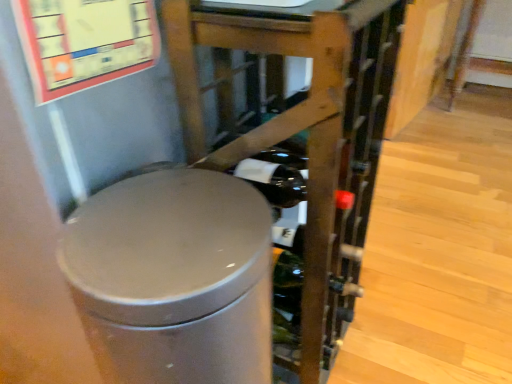
Where is `satin silver trash can at center`? satin silver trash can at center is located at coordinates click(x=174, y=278).

Describe the element at coordinates (174, 278) in the screenshot. I see `satin silver trash can at center` at that location.

Describe the element at coordinates (303, 150) in the screenshot. The height and width of the screenshot is (384, 512). I see `matte gray trash can at center` at that location.

The height and width of the screenshot is (384, 512). I want to click on matte gray trash can at center, so point(303,150).

Image resolution: width=512 pixels, height=384 pixels. I want to click on satin silver trash can at center, so click(174, 278).

Does satin silver trash can at center appear on the right side of matte gray trash can at center?

Incorrect, satin silver trash can at center is not on the right side of matte gray trash can at center.

In the image, is satin silver trash can at center positioned in front of or behind matte gray trash can at center?

Visually, satin silver trash can at center is located in front of matte gray trash can at center.

Is point (161, 345) less distant than point (315, 8)?

Yes.

From the image's perspective, is satin silver trash can at center above or below matte gray trash can at center?

satin silver trash can at center is situated lower than matte gray trash can at center in the image.

From a real-world perspective, is satin silver trash can at center physically located above or below matte gray trash can at center?

From a real-world perspective, satin silver trash can at center is physically below matte gray trash can at center.

Can you confirm if satin silver trash can at center is wider than matte gray trash can at center?

In fact, satin silver trash can at center might be narrower than matte gray trash can at center.

From their relative heights in the image, would you say satin silver trash can at center is taller or shorter than matte gray trash can at center?

satin silver trash can at center is shorter than matte gray trash can at center.

Which of these two, satin silver trash can at center or matte gray trash can at center, is bigger?

matte gray trash can at center is bigger.

Choose the correct answer: Is satin silver trash can at center inside matte gray trash can at center or outside it?

The correct answer is: outside.

Is the surface of satin silver trash can at center in direct contact with matte gray trash can at center?

There is a gap between satin silver trash can at center and matte gray trash can at center.

Is matte gray trash can at center at the back of satin silver trash can at center?

satin silver trash can at center does not have its back to matte gray trash can at center.

Can you tell me how much satin silver trash can at center and matte gray trash can at center differ in facing direction?

There is a 0.000282-degree angle between the facing directions of satin silver trash can at center and matte gray trash can at center.

I want to click on waste container on the left of matte gray trash can at center, so click(x=174, y=278).

Is matte gray trash can at center to the right of satin silver trash can at center from the viewer's perspective?

Indeed, matte gray trash can at center is positioned on the right side of satin silver trash can at center.

Considering their positions, is matte gray trash can at center located in front of or behind satin silver trash can at center?

In the image, matte gray trash can at center appears behind satin silver trash can at center.

Is point (225, 8) positioned after point (269, 310)?

No.

From the image's perspective, who appears lower, matte gray trash can at center or satin silver trash can at center?

satin silver trash can at center, from the image's perspective.

From a real-world perspective, does matte gray trash can at center sit lower than satin silver trash can at center?

Actually, matte gray trash can at center is physically above satin silver trash can at center in the real world.

Which of these two, matte gray trash can at center or satin silver trash can at center, is wider?

matte gray trash can at center is wider.

From their relative heights in the image, would you say matte gray trash can at center is taller or shorter than satin silver trash can at center?

In the image, matte gray trash can at center appears to be taller than satin silver trash can at center.

Looking at the image, does matte gray trash can at center seem bigger or smaller compared to satin silver trash can at center?

matte gray trash can at center is bigger than satin silver trash can at center.

Is matte gray trash can at center completely or partially outside of satin silver trash can at center?

matte gray trash can at center lies outside satin silver trash can at center's area.

Is matte gray trash can at center beside satin silver trash can at center?

matte gray trash can at center and satin silver trash can at center are clearly separated.

Is matte gray trash can at center positioned with its back to satin silver trash can at center?

No, matte gray trash can at center's orientation is not away from satin silver trash can at center.

How different are the orientations of matte gray trash can at center and satin silver trash can at center in degrees?

They differ by 0.000282 degrees in their facing directions.

Where is `furniture above the satin silver trash can at center (from the image's perspective)`? This screenshot has width=512, height=384. furniture above the satin silver trash can at center (from the image's perspective) is located at coordinates (303, 150).

This screenshot has height=384, width=512. In order to click on furniture above the satin silver trash can at center (from a real-world perspective) in this screenshot , I will do pos(303,150).

This screenshot has width=512, height=384. In the image, there is a matte gray trash can at center. What are the coordinates of `waste container below it (from a real-world perspective)` in the screenshot? It's located at (174, 278).